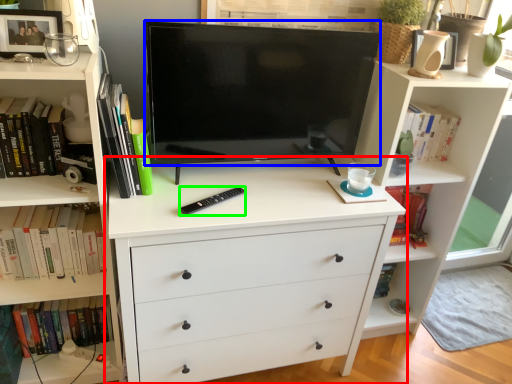
Question: Considering the real-world distances, which object is closest to chest of drawers (highlighted by a red box)? television (highlighted by a blue box) or flat (highlighted by a green box).

Choices:
 (A) television
 (B) flat

Answer: (B)